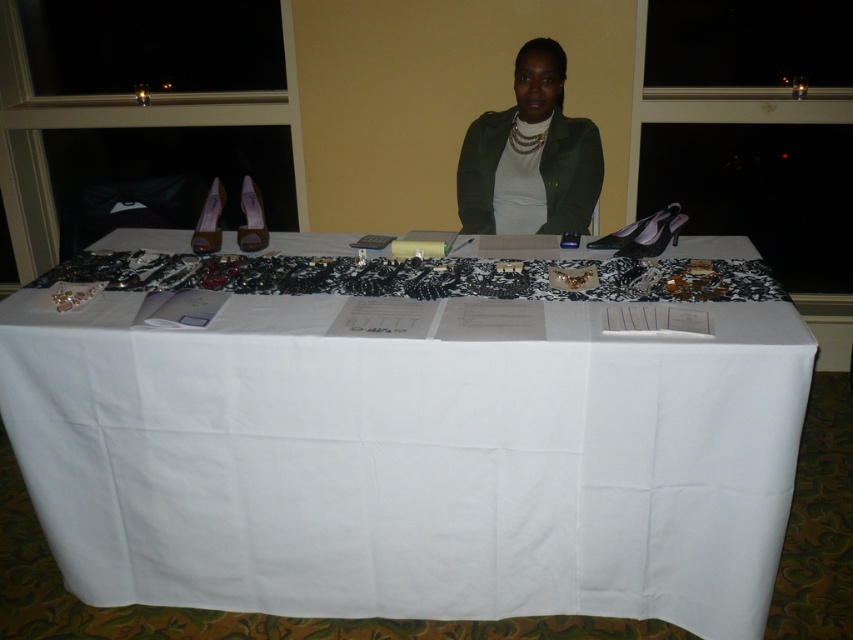
Is point (583, 611) more distant than point (601, 173)?

No, it is not.

Does white fabric table at center have a lesser width compared to green matte jacket at center?

Incorrect, white fabric table at center's width is not less than green matte jacket at center's.

Which is behind, point (183, 397) or point (474, 196)?

Point (474, 196)

Locate an element on the screen. The height and width of the screenshot is (640, 853). white fabric table at center is located at coordinates (410, 461).